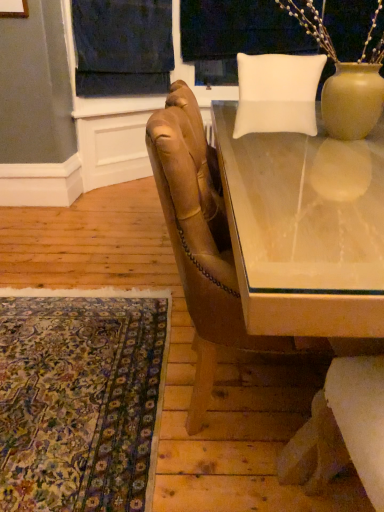
Question: Considering the relative sizes of carpet with intricate patterns at lower left and white fabric at upper center in the image provided, is carpet with intricate patterns at lower left thinner than white fabric at upper center?

Choices:
 (A) yes
 (B) no

Answer: (B)

Question: Is carpet with intricate patterns at lower left turned away from white fabric at upper center?

Choices:
 (A) yes
 (B) no

Answer: (B)

Question: Would you say white fabric at upper center is part of carpet with intricate patterns at lower left's contents?

Choices:
 (A) no
 (B) yes

Answer: (A)

Question: Is carpet with intricate patterns at lower left closer to camera compared to white fabric at upper center?

Choices:
 (A) yes
 (B) no

Answer: (A)

Question: Is carpet with intricate patterns at lower left smaller than white fabric at upper center?

Choices:
 (A) no
 (B) yes

Answer: (B)

Question: Does point (198, 388) appear closer or farther from the camera than point (241, 266)?

Choices:
 (A) closer
 (B) farther

Answer: (B)

Question: Is leather armchair at center wider or thinner than clear glass table at center?

Choices:
 (A) wide
 (B) thin

Answer: (B)

Question: Would you say leather armchair at center is to the left or to the right of clear glass table at center in the picture?

Choices:
 (A) left
 (B) right

Answer: (A)

Question: Considering their positions, is leather armchair at center located in front of or behind clear glass table at center?

Choices:
 (A) front
 (B) behind

Answer: (B)

Question: Considering the positions of clear glass table at center and white fabric at upper center in the image, is clear glass table at center wider or thinner than white fabric at upper center?

Choices:
 (A) wide
 (B) thin

Answer: (A)

Question: From the image's perspective, is clear glass table at center positioned above or below white fabric at upper center?

Choices:
 (A) above
 (B) below

Answer: (B)

Question: Is point (299, 300) positioned closer to the camera than point (210, 15)?

Choices:
 (A) farther
 (B) closer

Answer: (B)

Question: Is clear glass table at center inside or outside of white fabric at upper center?

Choices:
 (A) outside
 (B) inside

Answer: (A)

Question: Is white fabric at upper center in front of or behind clear glass table at center in the image?

Choices:
 (A) behind
 (B) front

Answer: (A)

Question: In terms of height, does white fabric at upper center look taller or shorter compared to clear glass table at center?

Choices:
 (A) short
 (B) tall

Answer: (B)